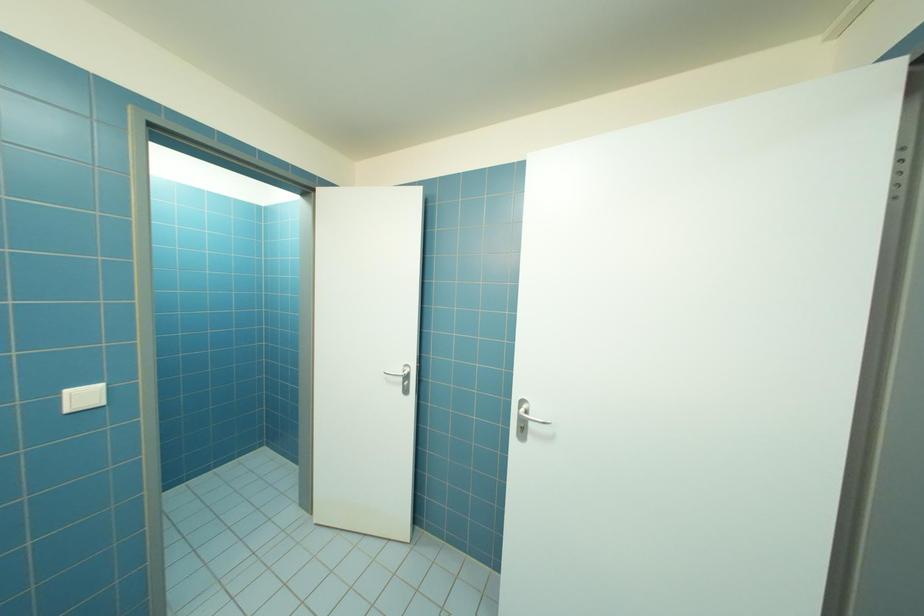
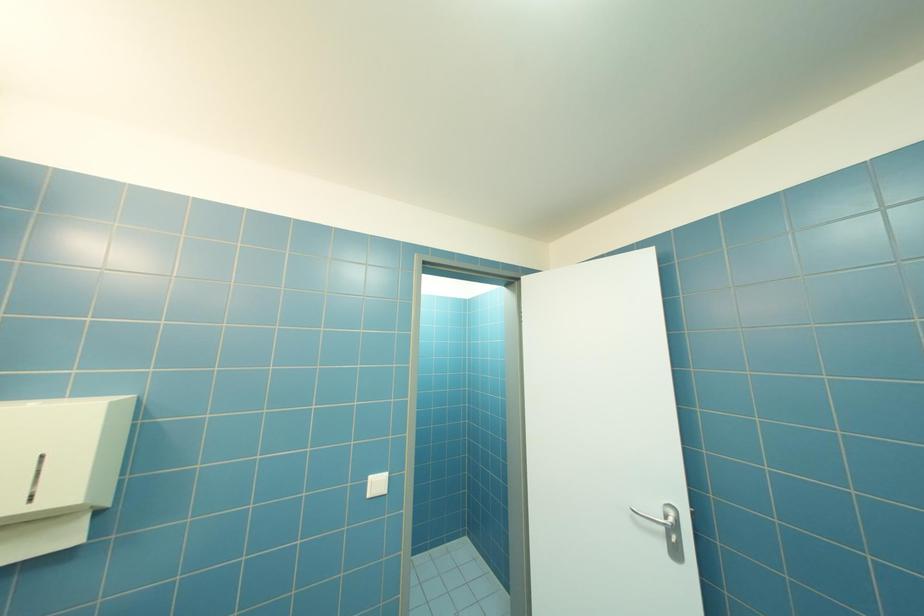
Question: Based on the continuous images, in which direction is the camera rotating? Reply with the corresponding letter.

Choices:
 (A) Left
 (B) Right
 (C) Up
 (D) Down

Answer: (A)